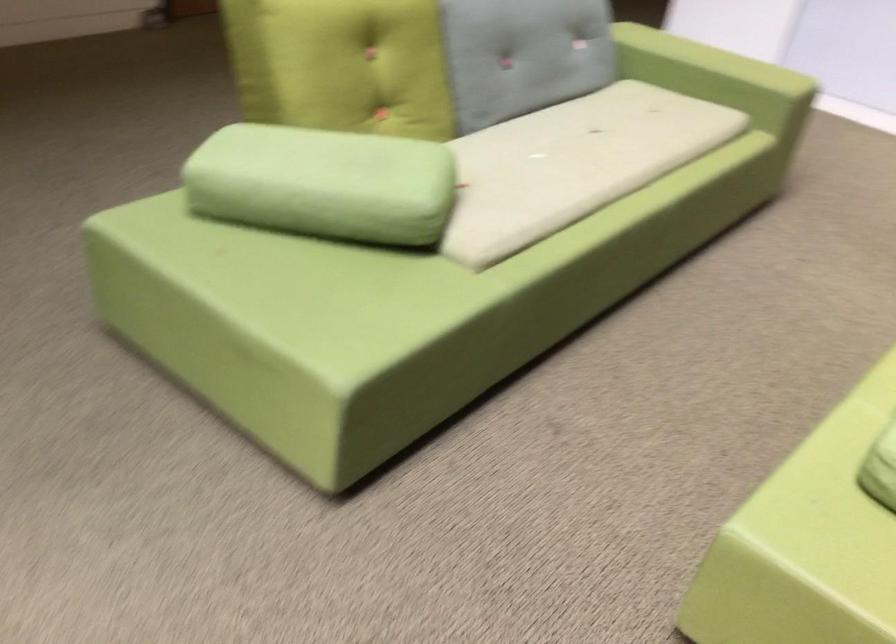
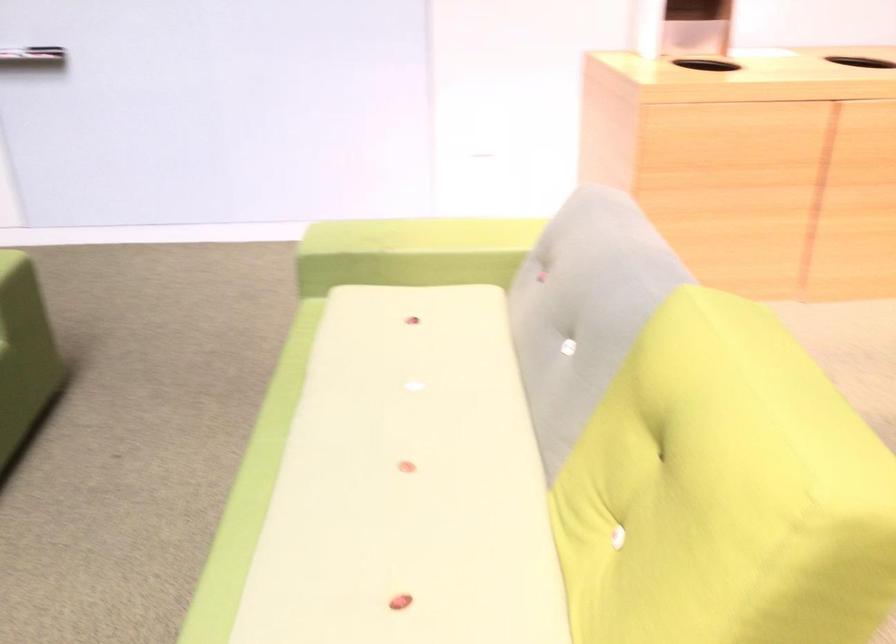
Question: The camera is either moving clockwise (left) or counter-clockwise (right) around the object. The first image is from the beginning of the video and the second image is from the end. Is the camera moving left or right when shooting the video?

Choices:
 (A) Left
 (B) Right

Answer: (A)